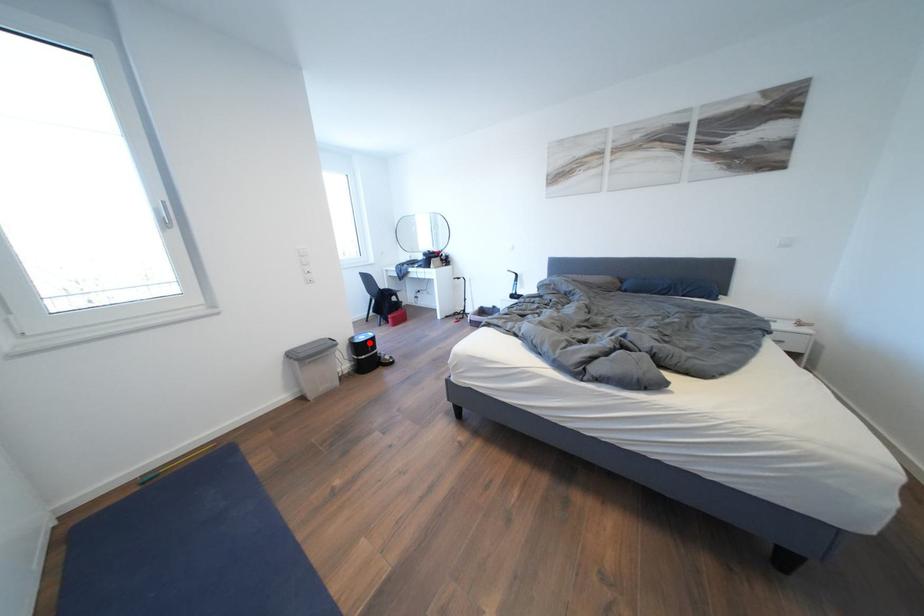
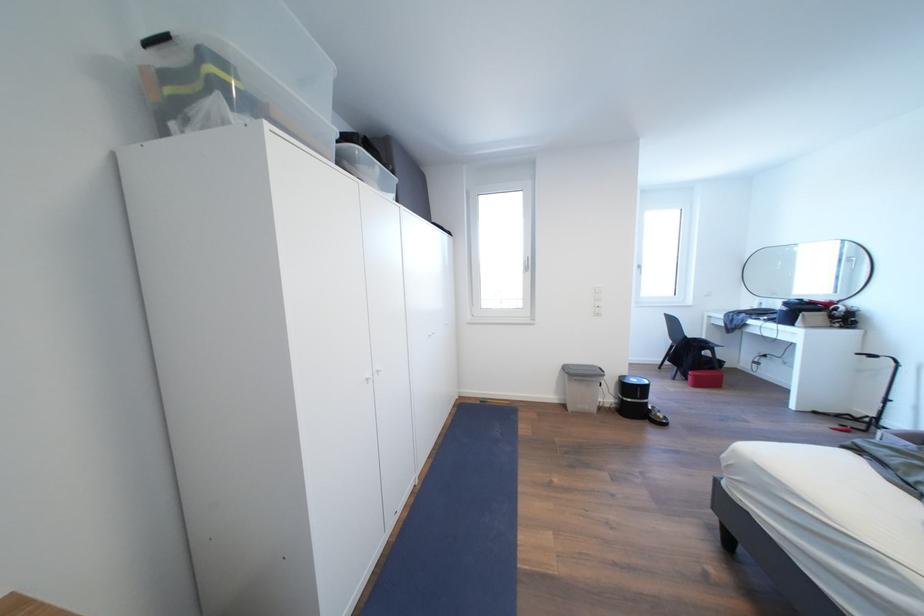
Find the pixel in the second image that matches the highlighted location in the first image.

(641, 386)